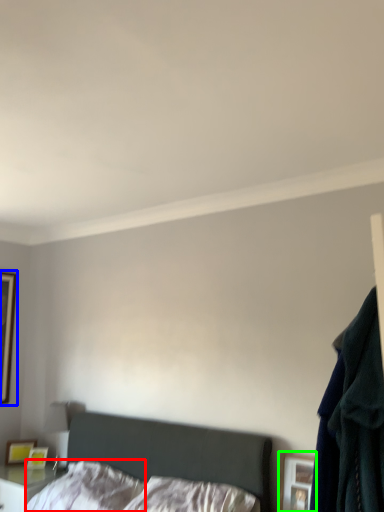
Question: Which object is the farthest from pillow (highlighted by a red box)? Choose among these: picture frame (highlighted by a blue box) or picture frame (highlighted by a green box).

Choices:
 (A) picture frame
 (B) picture frame

Answer: (A)